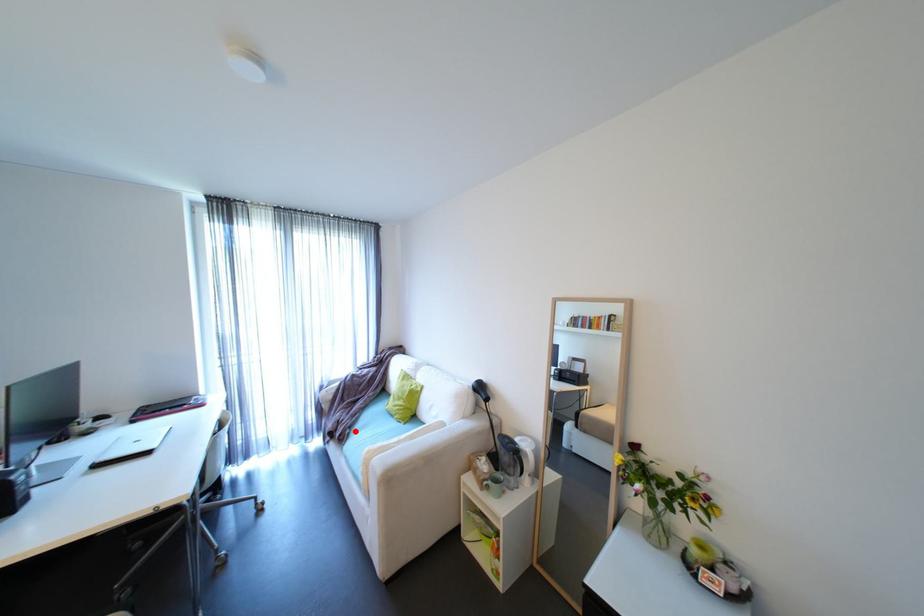
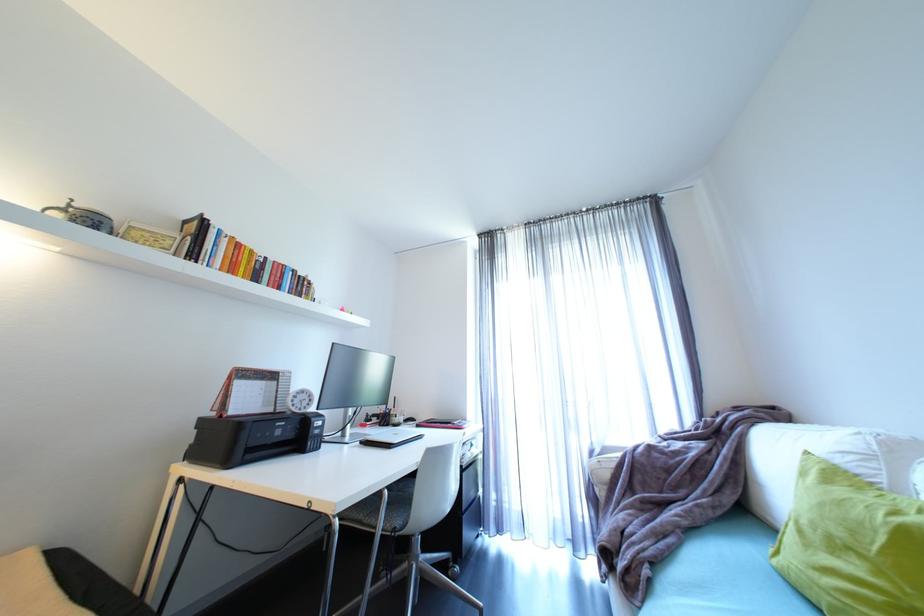
Question: I am providing you with two images of the same scene from different viewpoints. A red point is marked on the first image. Is the red point's position out of view in image 2?

Choices:
 (A) Yes
 (B) No

Answer: (B)